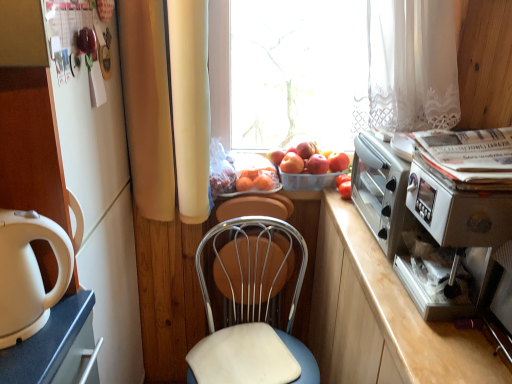
Question: In terms of height, does orange matte at center look taller or shorter compared to metallic blue chair at center?

Choices:
 (A) tall
 (B) short

Answer: (B)

Question: Is orange matte at center wider or thinner than metallic blue chair at center?

Choices:
 (A) wide
 (B) thin

Answer: (B)

Question: Which object is the closest to the smooth peach at center, which is the 4th apple in right-to-left order?

Choices:
 (A) orange matte at center
 (B) metallic silver toaster oven at right
 (C) red matte tomato at center
 (D) white glossy kettle at left
 (E) transparent glass window at center

Answer: (A)

Question: Estimate the real-world distances between objects in this image. Which object is closer to the red matte tomato at center?

Choices:
 (A) orange matte at center
 (B) red matte apple at center, the second apple when ordered from left to right
 (C) smooth peach at center, which is the 4th apple in right-to-left order
 (D) white glossy kettle at left
 (E) metallic silver swivel chair at center

Answer: (B)